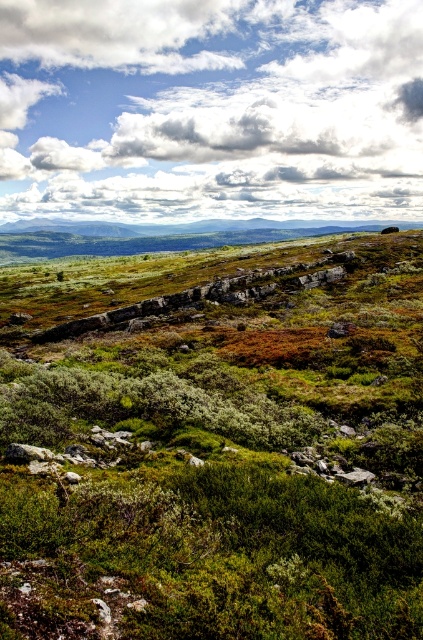
You are standing in the open landscape and want to take a photo of the green grassy field at center and the white fluffy cloud at upper center. Which object is positioned to the right side when looking at both?

The green grassy field at center is positioned to the right of the white fluffy cloud at upper center.

You are standing in the vast landscape and want to take a photo of the green grassy field at center and the white fluffy cloud at upper center. Which object will appear larger in the photo?

The green grassy field at center will appear larger in the photo because it is closer to the viewer than the white fluffy cloud at upper center.

Based on the provided scene description, can you identify the object located at the coordinates point (219, 451)?

The green grassy field at center is located at point (219, 451).